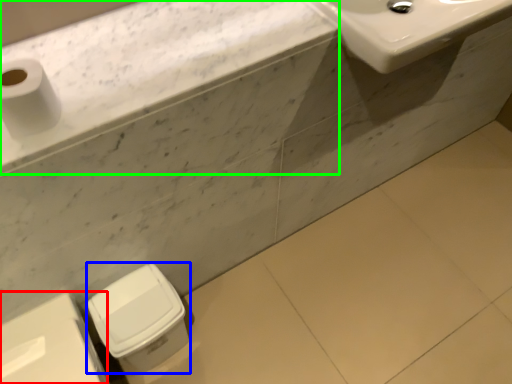
Question: Which object is the closest to the porcelain (highlighted by a red box)? Choose among these: porcelain (highlighted by a blue box) or counter top (highlighted by a green box).

Choices:
 (A) porcelain
 (B) counter top

Answer: (A)